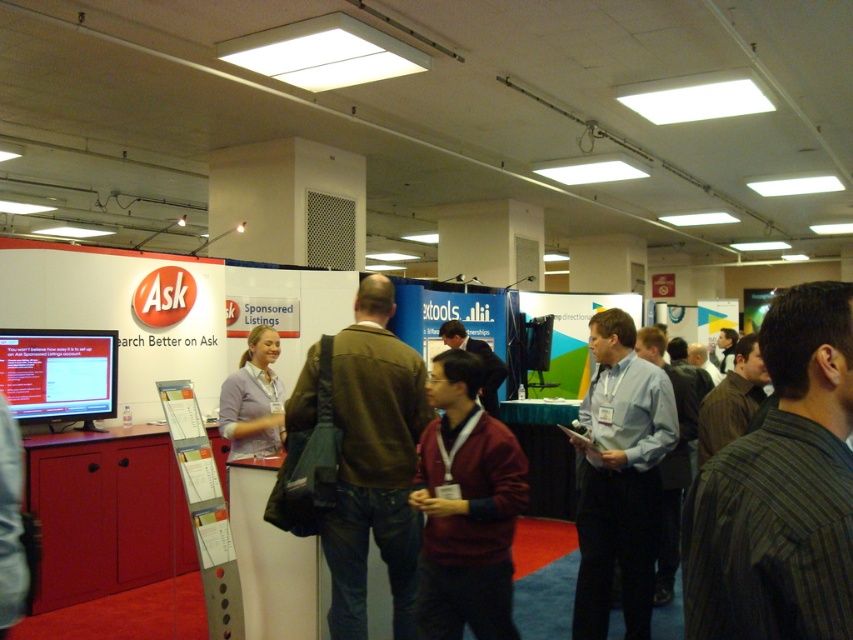
You are at a trade show and need to approach both the striped cotton shirt at center and the light blue shirt at center. Which one should you walk towards first to reach the one closer to you?

The striped cotton shirt at center is closer to the viewer than the light blue shirt at center, so you should walk towards the striped cotton shirt at center first.

You are a photographer at the event and need to capture a group photo of the striped cotton shirt at center and the light blue shirt at center. The minimum distance your camera can focus on two subjects is 1.5 meters. Will you be able to take the photo without moving either subject?

The distance between the striped cotton shirt at center and the light blue shirt at center is 1.28 meters, which is less than the camera minimum focus distance of 1.5 meters. Therefore, you will need to move the subjects further apart to take the photo.

You are an event organizer who needs to decide which item to move first. Since the striped cotton shirt at center and the brown leather jacket at center are both blocking the booth entrance, which one should you move first if you want to free up more space?

The striped cotton shirt at center is smaller than the brown leather jacket at center, so moving the brown leather jacket at center first will free up more space.